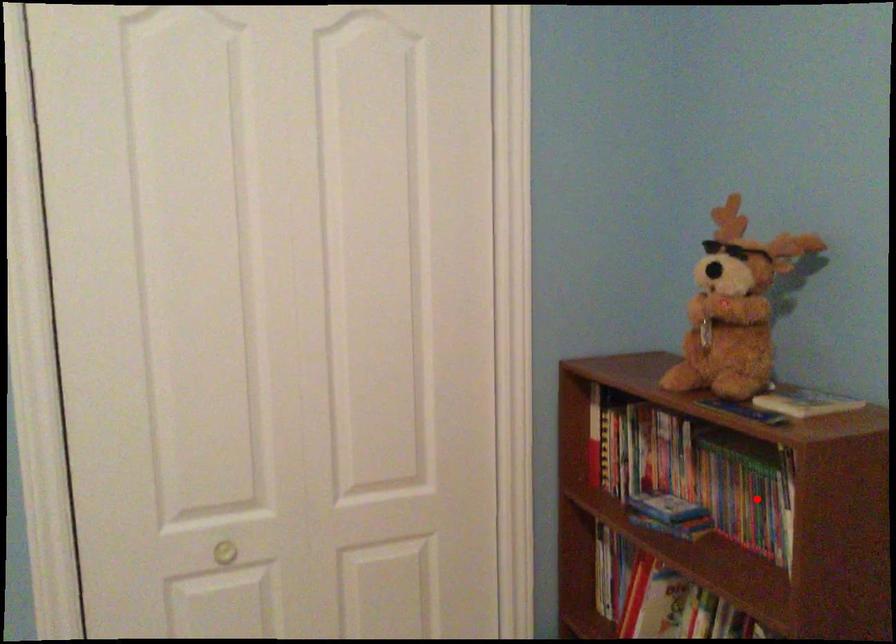
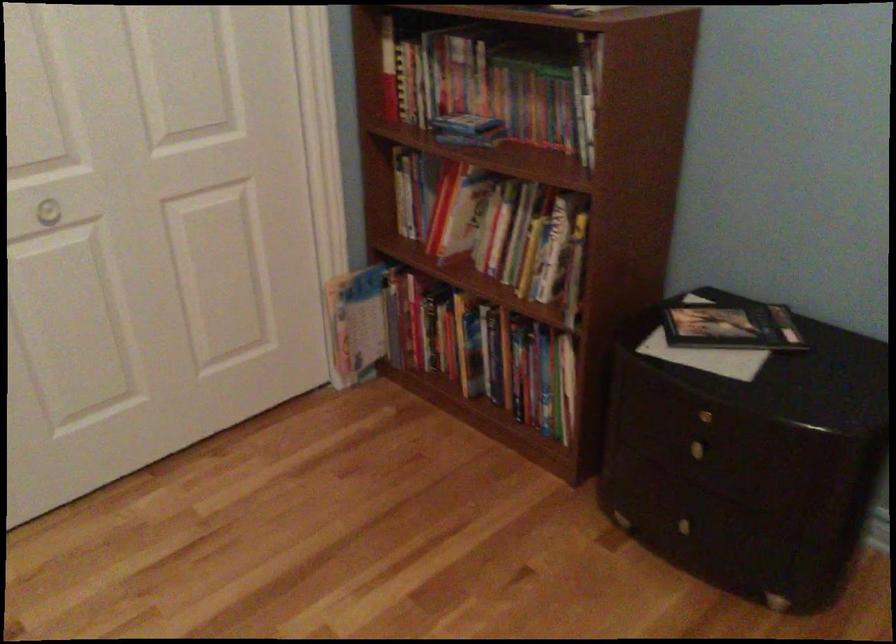
Question: I am providing you with two images of the same scene from different viewpoints. Image1 has a red point marked. In image2, the corresponding 3D location appears at what relative position? Reply with the corresponding letter.

Choices:
 (A) Closer
 (B) Farther

Answer: (B)